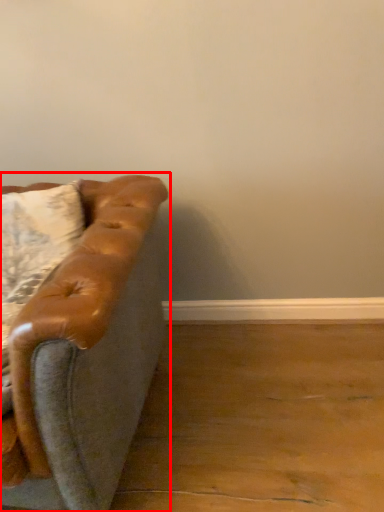
Question: From the image's perspective, where is studio couch (annotated by the red box) located relative to pillow?

Choices:
 (A) below
 (B) above

Answer: (A)